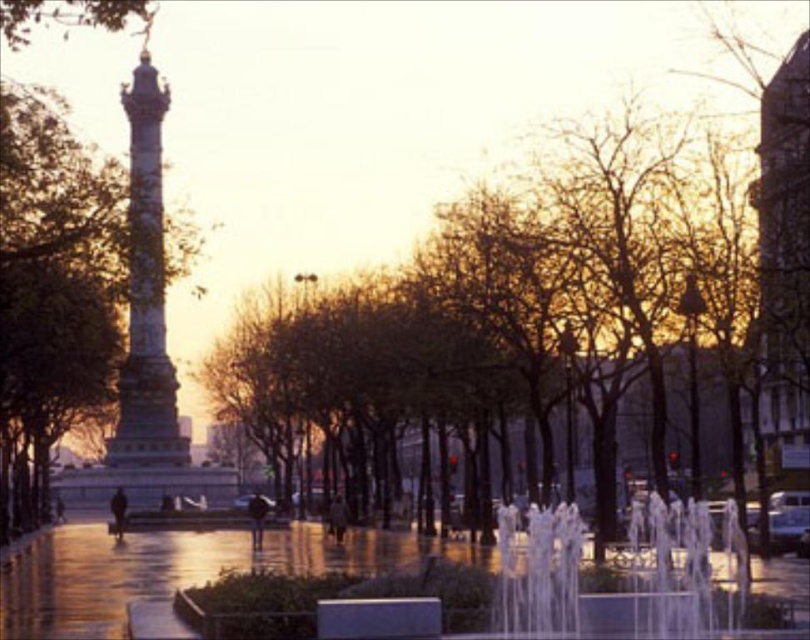
Can you confirm if brick textured tower at right is thinner than polished gold column at center?

Correct, brick textured tower at right's width is less than polished gold column at center's.

Find the location of `brick textured tower at right`. brick textured tower at right is located at coordinates (783, 250).

The height and width of the screenshot is (640, 810). Describe the element at coordinates (783, 250) in the screenshot. I see `brick textured tower at right` at that location.

Image resolution: width=810 pixels, height=640 pixels. In order to click on brick textured tower at right in this screenshot , I will do `click(783, 250)`.